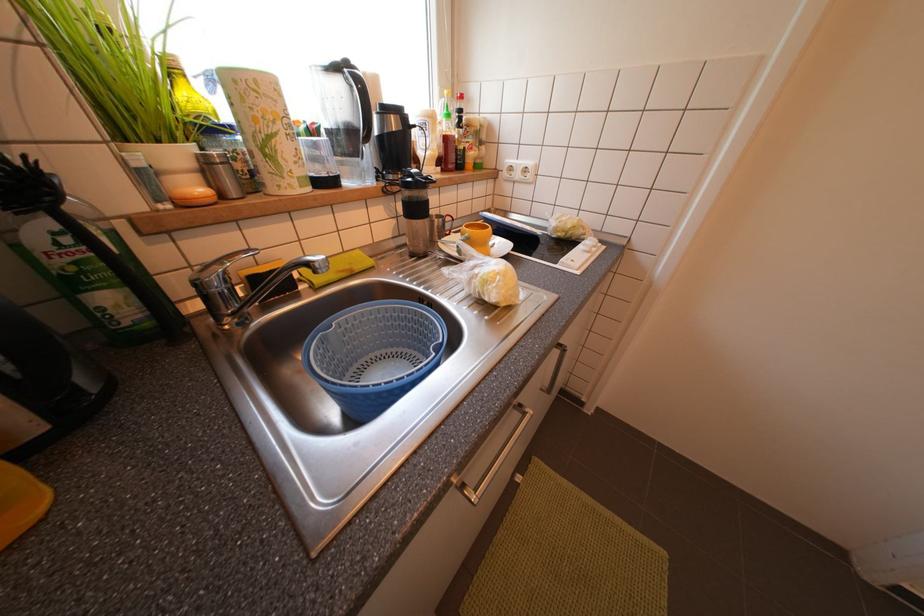
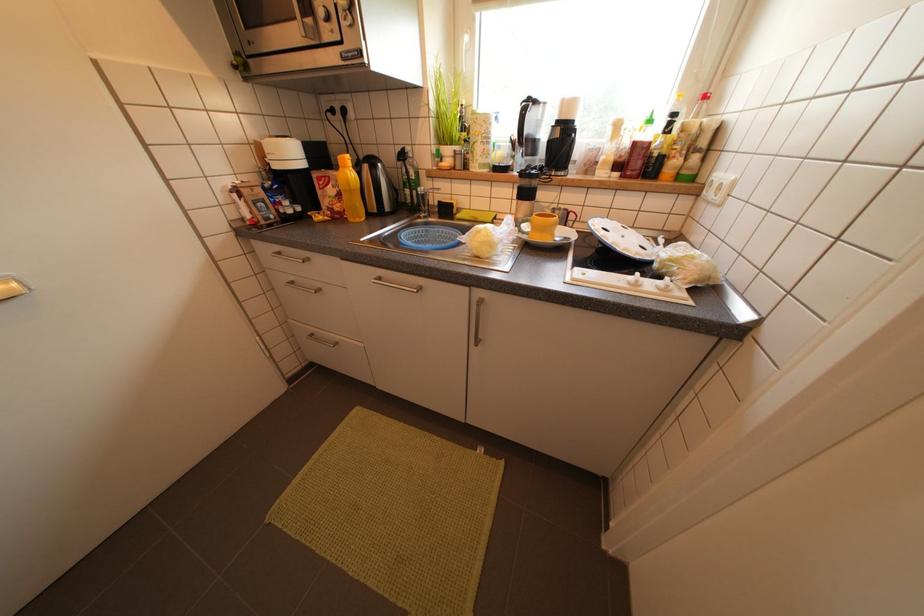
How did the camera likely rotate?

The rotation direction of the camera is left-down.